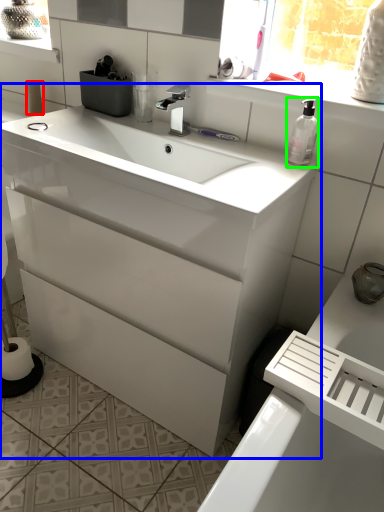
Question: Which is nearer to the toilet paper (highlighted by a red box)? bathroom cabinet (highlighted by a blue box) or soap dispenser (highlighted by a green box).

Choices:
 (A) bathroom cabinet
 (B) soap dispenser

Answer: (A)